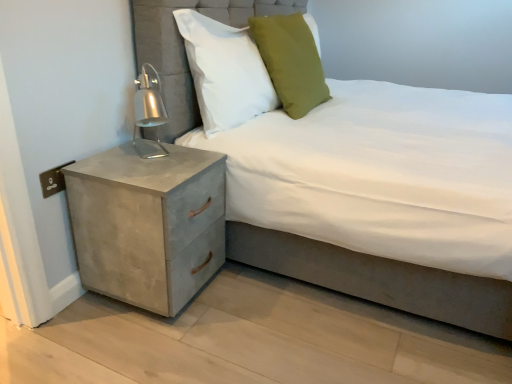
Question: From a real-world perspective, is green fabric pillow at upper center, the 1th pillow in the right-to-left sequence, below concrete textured nightstand at lower left?

Choices:
 (A) no
 (B) yes

Answer: (A)

Question: Is green fabric pillow at upper center, the 1th pillow in the right-to-left sequence, further to camera compared to concrete textured nightstand at lower left?

Choices:
 (A) no
 (B) yes

Answer: (B)

Question: From the image's perspective, does green fabric pillow at upper center, the 1th pillow in the right-to-left sequence, appear lower than concrete textured nightstand at lower left?

Choices:
 (A) yes
 (B) no

Answer: (B)

Question: Does green fabric pillow at upper center, the 1th pillow in the right-to-left sequence, lie in front of concrete textured nightstand at lower left?

Choices:
 (A) no
 (B) yes

Answer: (A)

Question: From a real-world perspective, is green fabric pillow at upper center, the 1th pillow in the right-to-left sequence, over concrete textured nightstand at lower left?

Choices:
 (A) yes
 (B) no

Answer: (A)

Question: Is green fabric pillow at upper center, placed as the second pillow when sorted from left to right, taller than concrete textured nightstand at lower left?

Choices:
 (A) yes
 (B) no

Answer: (A)

Question: Considering the relative sizes of white fabric pillow at upper center, the 1th pillow when ordered from left to right, and green fabric pillow at upper center, placed as the second pillow when sorted from left to right, in the image provided, is white fabric pillow at upper center, the 1th pillow when ordered from left to right, smaller than green fabric pillow at upper center, placed as the second pillow when sorted from left to right,?

Choices:
 (A) no
 (B) yes

Answer: (B)

Question: From a real-world perspective, is white fabric pillow at upper center, which ranks as the second pillow in right-to-left order, over green fabric pillow at upper center, placed as the second pillow when sorted from left to right?

Choices:
 (A) no
 (B) yes

Answer: (B)

Question: Is white fabric pillow at upper center, which ranks as the second pillow in right-to-left order, bigger than green fabric pillow at upper center, the 1th pillow in the right-to-left sequence?

Choices:
 (A) yes
 (B) no

Answer: (B)

Question: Is white fabric pillow at upper center, the 1th pillow when ordered from left to right, surrounding green fabric pillow at upper center, placed as the second pillow when sorted from left to right?

Choices:
 (A) no
 (B) yes

Answer: (A)

Question: Does white fabric pillow at upper center, the 1th pillow when ordered from left to right, turn towards green fabric pillow at upper center, placed as the second pillow when sorted from left to right?

Choices:
 (A) yes
 (B) no

Answer: (B)

Question: Is white fabric pillow at upper center, which ranks as the second pillow in right-to-left order, looking in the opposite direction of green fabric pillow at upper center, placed as the second pillow when sorted from left to right?

Choices:
 (A) no
 (B) yes

Answer: (A)

Question: Is suede-like gray bed at center beside concrete textured nightstand at lower left?

Choices:
 (A) no
 (B) yes

Answer: (A)